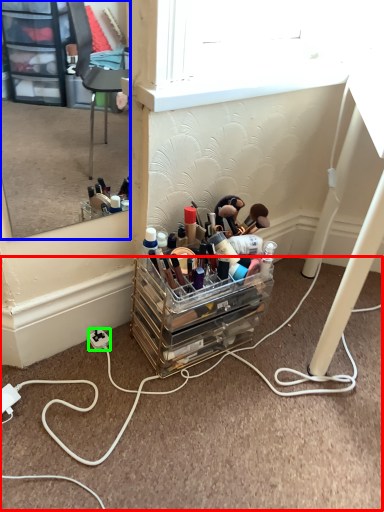
Question: Considering the real-world distances, which object is farthest from cable (highlighted by a red box)? mirror (highlighted by a blue box) or power outlet (highlighted by a green box)?

Choices:
 (A) mirror
 (B) power outlet

Answer: (A)